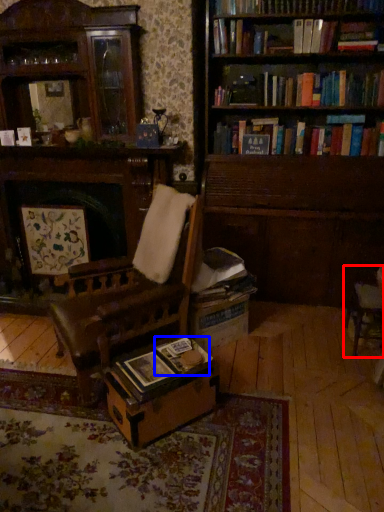
Question: Which object appears closest to the camera in this image, chair (highlighted by a red box) or paperback book (highlighted by a blue box)?

Choices:
 (A) chair
 (B) paperback book

Answer: (B)